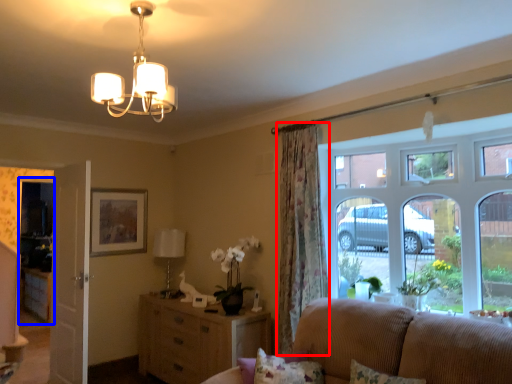
Question: Which of the following is the farthest to the observer, curtain (highlighted by a red box) or glass door (highlighted by a blue box)?

Choices:
 (A) curtain
 (B) glass door

Answer: (B)